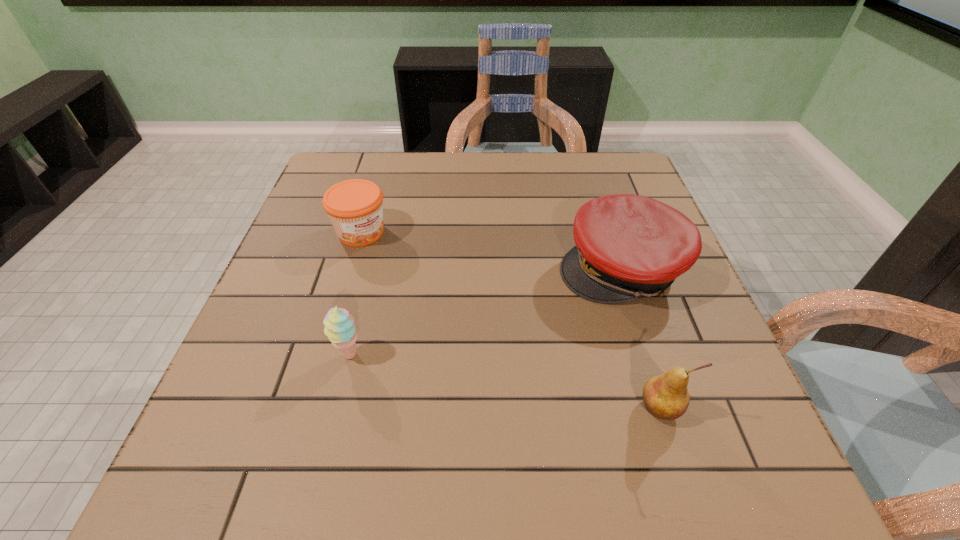
The height and width of the screenshot is (540, 960). In order to click on unoccupied position between the nearest object and the cap in this screenshot , I will do `click(640, 339)`.

Where is `vacant space that's between the cap and the jam`? The image size is (960, 540). vacant space that's between the cap and the jam is located at coordinates (491, 251).

At what (x,y) coordinates should I click in order to perform the action: click on vacant area between the nearest object and the sherbert. Please return your answer as a coordinate pair (x, y). Image resolution: width=960 pixels, height=540 pixels. Looking at the image, I should click on (505, 381).

Choose which object is the nearest neighbor to the sherbert. Please provide its 2D coordinates. Your answer should be formatted as a tuple, i.e. [(x, y)], where the tuple contains the x and y coordinates of a point satisfying the conditions above.

[(355, 207)]

Image resolution: width=960 pixels, height=540 pixels. I want to click on the second closest object to the sherbert, so click(628, 246).

Identify the location of vacant space that satisfies the following two spatial constraints: 1. on the front side of the cap; 2. on the right side of the jam. This screenshot has width=960, height=540. (350, 269).

Locate an element on the screen. The width and height of the screenshot is (960, 540). free space in the image that satisfies the following two spatial constraints: 1. on the back side of the pear; 2. on the right side of the cap is located at coordinates (616, 269).